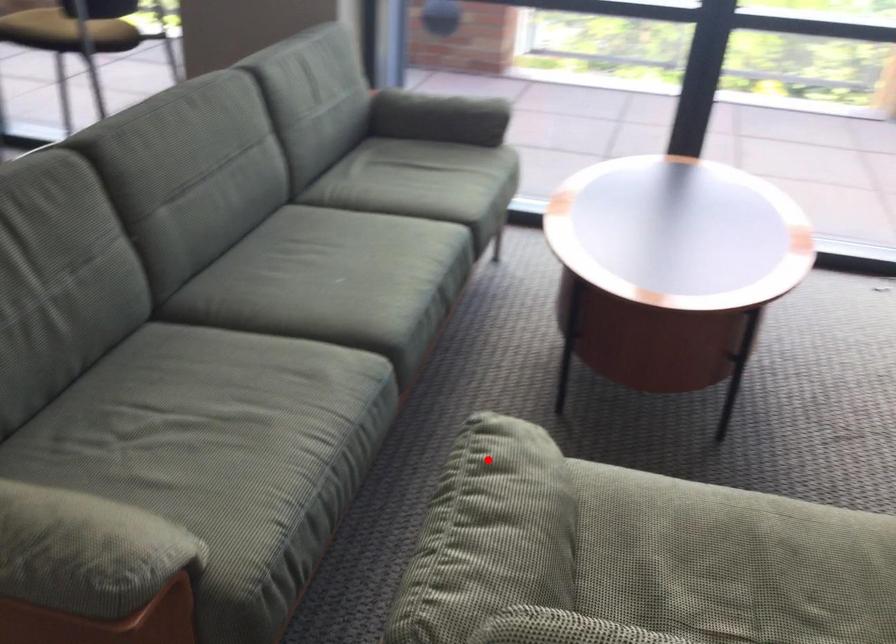
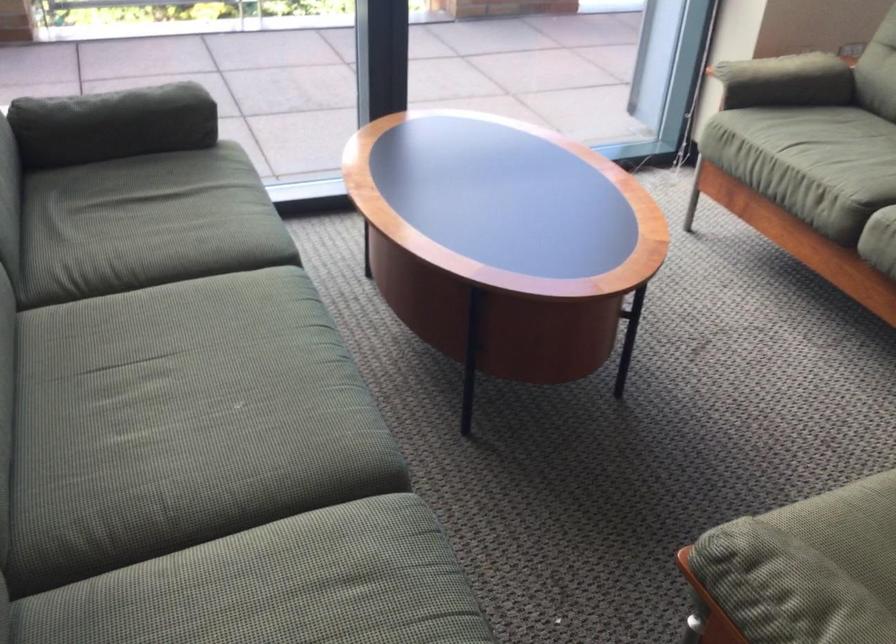
Question: I am providing you with two images of the same scene from different viewpoints. A red point is marked on the first image. Can you still see the location of the red point in image 2?

Choices:
 (A) Yes
 (B) No

Answer: (A)